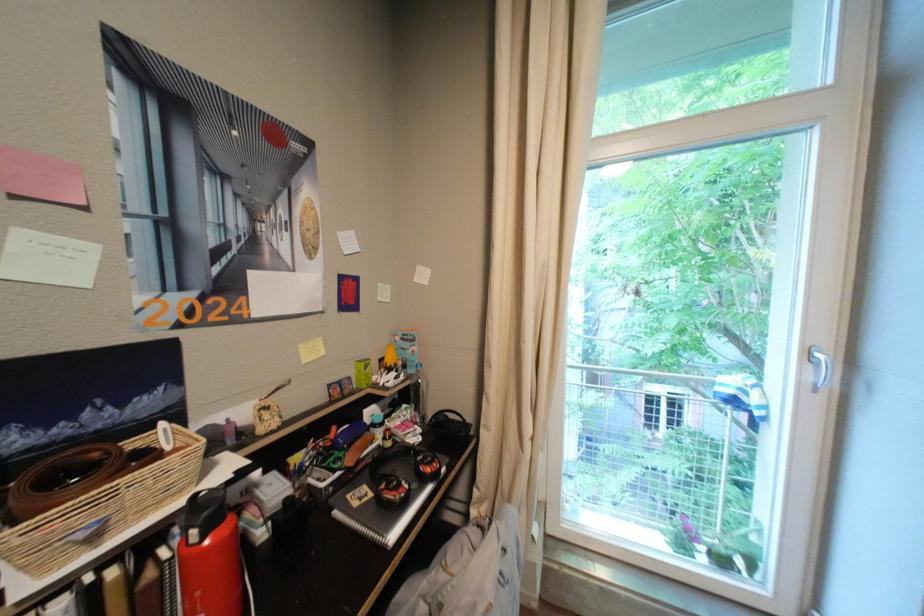
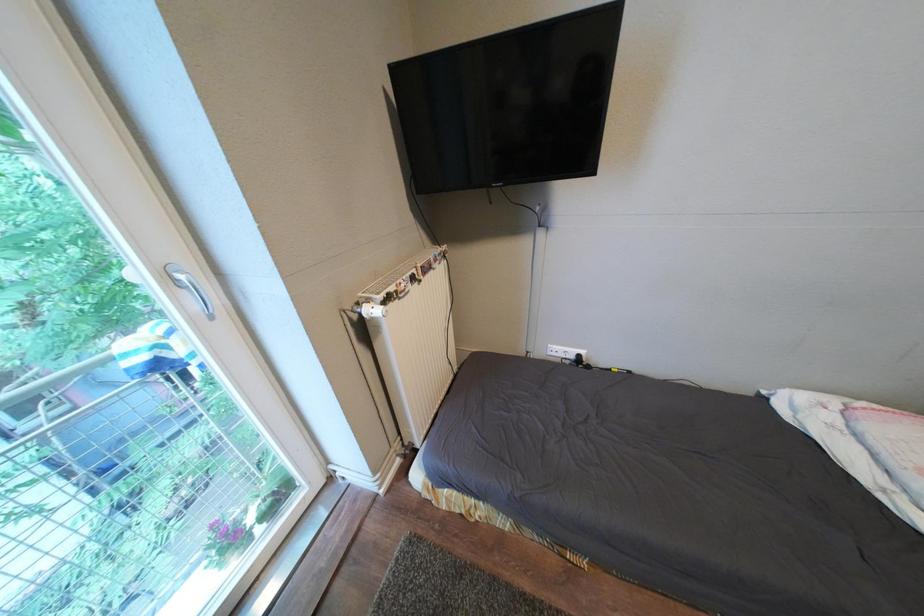
How did the camera likely rotate?

The rotation direction of the camera is right-down.